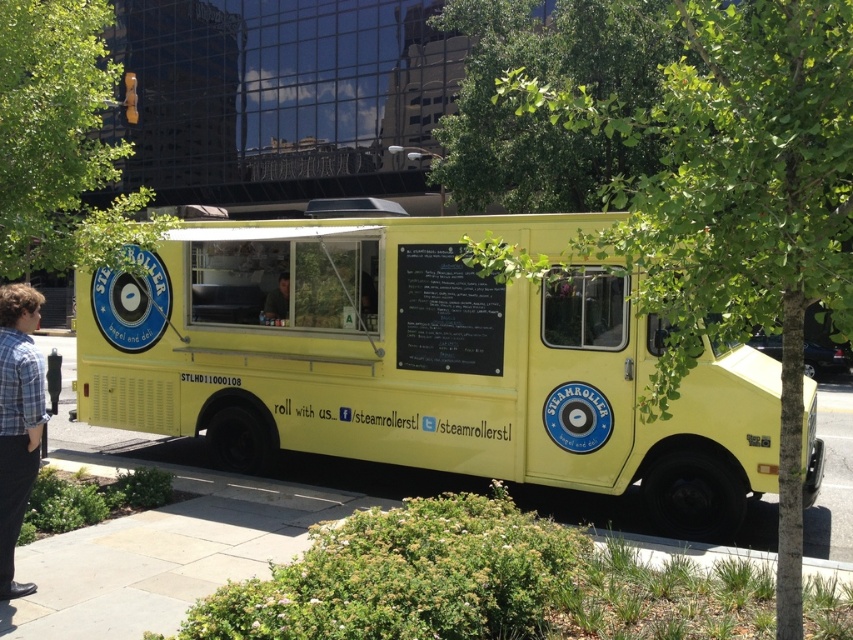
Question: Which of these objects is positioned farthest from the yellow matte food truck at center?

Choices:
 (A) black chalkboard at center
 (B) matte black shirt at center
 (C) plaid shirt at left

Answer: (C)

Question: Based on their relative distances, which object is nearer to the green leafy tree at upper center?

Choices:
 (A) black chalkboard at center
 (B) green leafy tree at center
 (C) plaid shirt at left

Answer: (A)

Question: Does green leafy tree at center appear on the left side of green leafy tree at upper center?

Choices:
 (A) yes
 (B) no

Answer: (B)

Question: Is yellow matte food truck at center in front of green leafy tree at upper center?

Choices:
 (A) yes
 (B) no

Answer: (B)

Question: Can you confirm if green leafy tree at upper center is positioned to the left of plaid shirt at left?

Choices:
 (A) yes
 (B) no

Answer: (A)

Question: Among these objects, which one is nearest to the camera?

Choices:
 (A) green leafy tree at center
 (B) black chalkboard at center
 (C) plaid shirt at left
 (D) matte black shirt at center

Answer: (A)